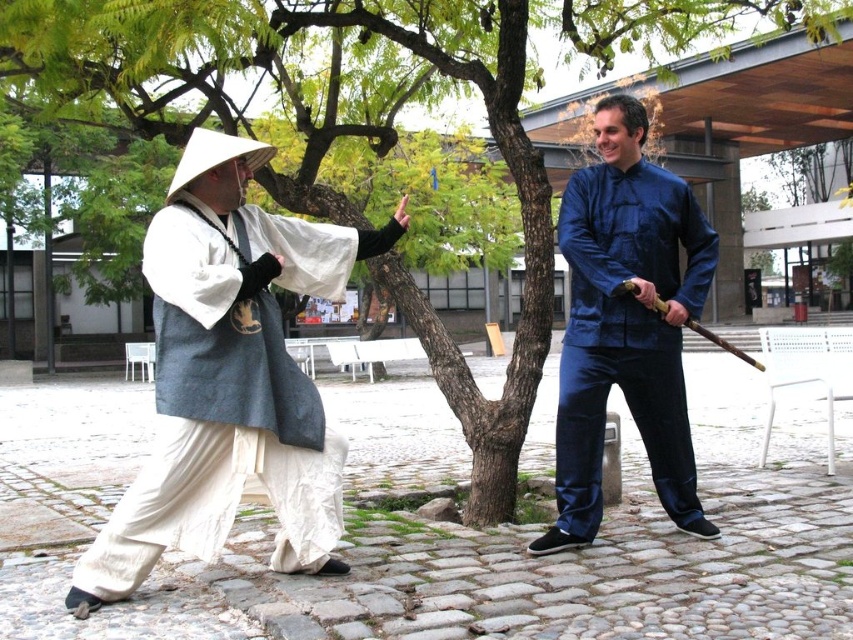
Question: Is white cotton robe at left below blue silk shirt at right?

Choices:
 (A) yes
 (B) no

Answer: (A)

Question: Which of the following is the farthest from the observer?

Choices:
 (A) white cotton robe at left
 (B) blue silk shirt at right

Answer: (B)

Question: Which object appears closest to the camera in this image?

Choices:
 (A) blue silk shirt at right
 (B) white cotton robe at left

Answer: (B)

Question: Is the position of white cotton robe at left more distant than that of blue silk shirt at right?

Choices:
 (A) no
 (B) yes

Answer: (A)

Question: Is white cotton robe at left smaller than blue silk shirt at right?

Choices:
 (A) no
 (B) yes

Answer: (A)